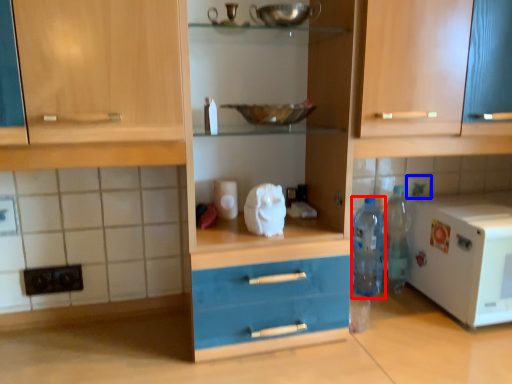
Question: Which of the following is the farthest to the observer, bottle (highlighted by a red box) or tile (highlighted by a blue box)?

Choices:
 (A) bottle
 (B) tile

Answer: (B)